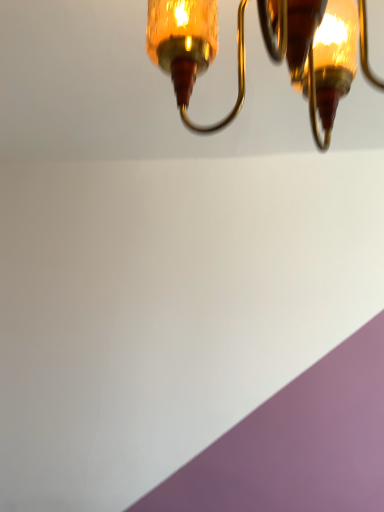
This screenshot has height=512, width=384. Describe the element at coordinates (191, 49) in the screenshot. I see `amber glass lamp at upper center` at that location.

At what (x,y) coordinates should I click in order to perform the action: click on amber glass lamp at upper center. Please return your answer as a coordinate pair (x, y). The height and width of the screenshot is (512, 384). Looking at the image, I should click on (191, 49).

I want to click on amber glass lamp at upper center, so click(x=191, y=49).